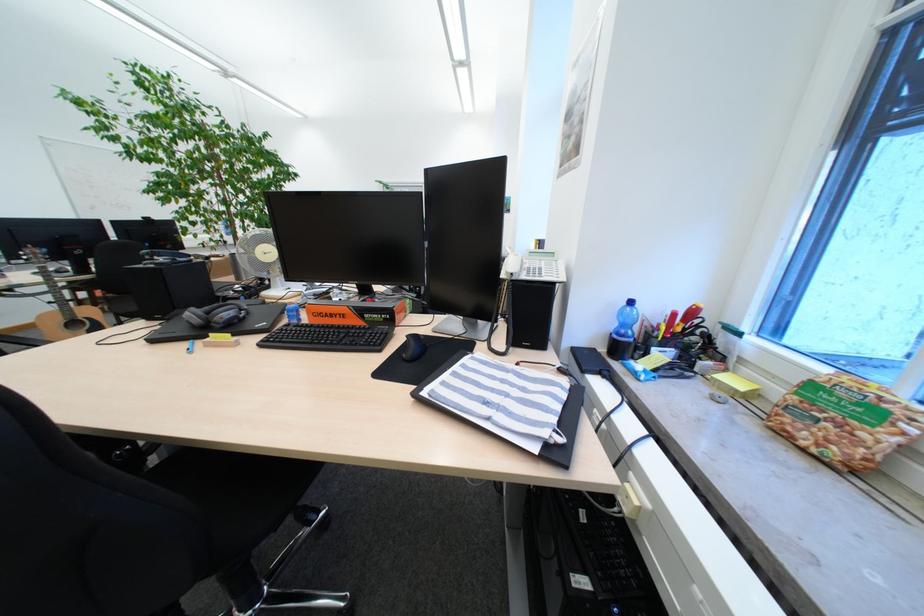
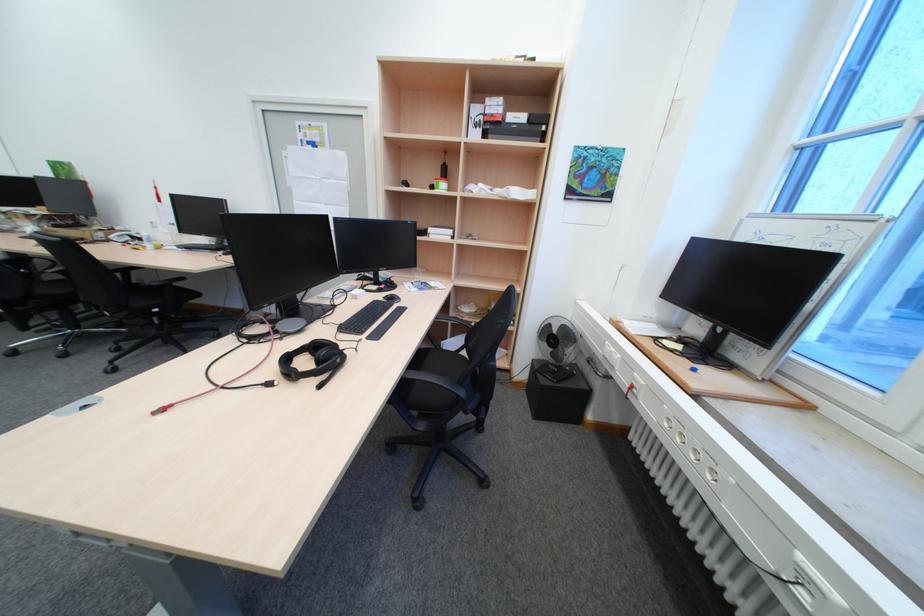
Question: Which direction would the cameraman need to move to produce the second image? Reply with the corresponding letter.

Choices:
 (A) Left
 (B) Right
 (C) Forward
 (D) Backward

Answer: (C)